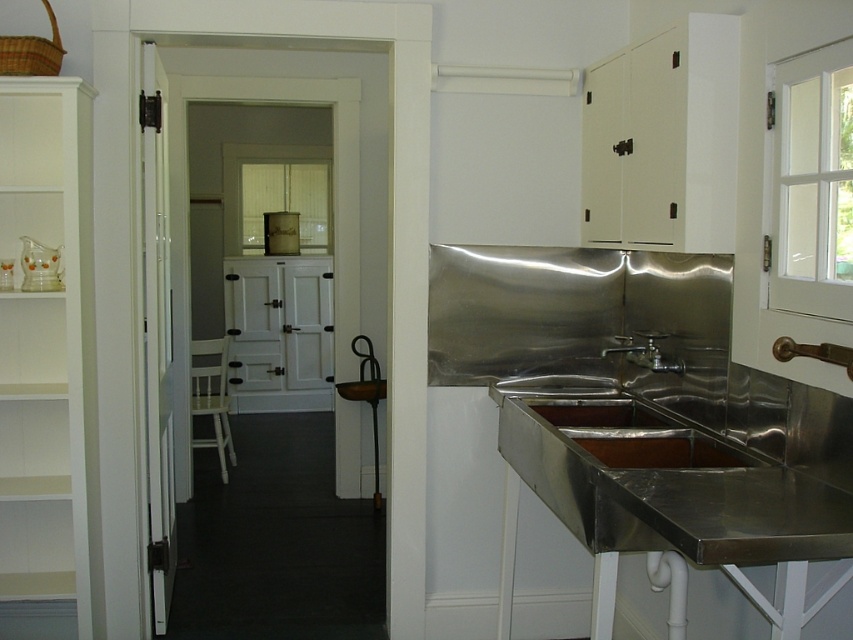
Question: Is stainless steel sink at lower right below silver metallic faucet at center?

Choices:
 (A) no
 (B) yes

Answer: (B)

Question: Which point is farther to the camera?

Choices:
 (A) silver metallic faucet at center
 (B) stainless steel sink at lower right

Answer: (A)

Question: Which object appears closest to the camera in this image?

Choices:
 (A) silver metallic faucet at center
 (B) stainless steel sink at lower right

Answer: (B)

Question: Is stainless steel sink at lower right in front of silver metallic faucet at center?

Choices:
 (A) yes
 (B) no

Answer: (A)

Question: Which object appears closest to the camera in this image?

Choices:
 (A) silver metallic faucet at center
 (B) stainless steel sink at lower right

Answer: (B)

Question: From the image, what is the correct spatial relationship of stainless steel sink at lower right in relation to silver metallic faucet at center?

Choices:
 (A) left
 (B) right

Answer: (A)